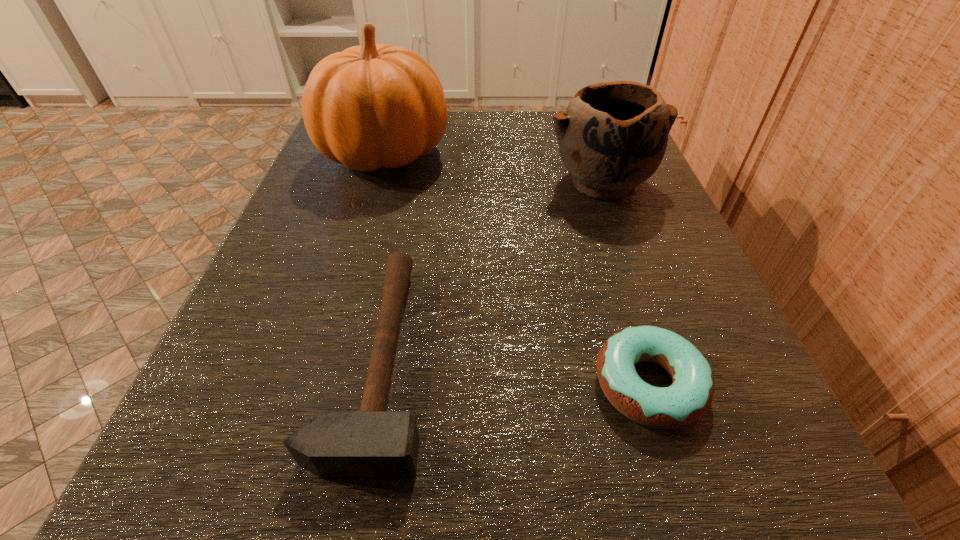
The image size is (960, 540). Identify the location of free spot at the right edge of the desktop. (757, 381).

Where is `vacant area at the near left corner of the desktop`? Image resolution: width=960 pixels, height=540 pixels. vacant area at the near left corner of the desktop is located at coordinates (168, 510).

Find the location of a particular element. vacant point at the far right corner is located at coordinates pyautogui.click(x=547, y=114).

I want to click on blank region between the second shortest object and the tallest object, so click(x=382, y=256).

Where is `empty location between the tallest object and the third tallest object`? empty location between the tallest object and the third tallest object is located at coordinates (382, 256).

The image size is (960, 540). What are the coordinates of `free space between the shortest object and the third shortest object` in the screenshot? It's located at (x=625, y=284).

You are a GUI agent. You are given a task and a screenshot of the screen. Output one action in this format:
    pyautogui.click(x=<x>, y=<y>)
    Task: Click on the empty space that is in between the doughnut and the pumpkin
    This screenshot has width=960, height=540.
    Given the screenshot: What is the action you would take?
    pyautogui.click(x=517, y=269)

Where is `free space between the second shortest object and the shortest object`? The width and height of the screenshot is (960, 540). free space between the second shortest object and the shortest object is located at coordinates (514, 372).

Where is `free spot between the pottery and the pumpkin`? free spot between the pottery and the pumpkin is located at coordinates (494, 168).

Find the location of a particular element. The image size is (960, 540). unoccupied area between the shortest object and the tallest object is located at coordinates (517, 269).